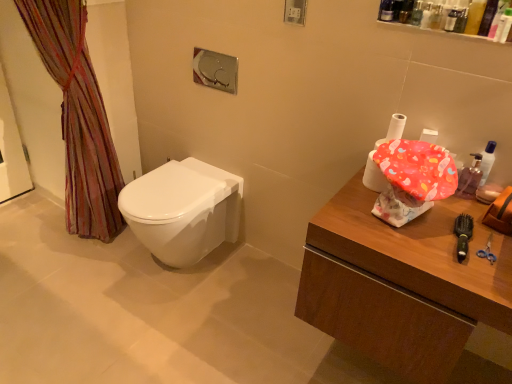
Locate an element on the screen. The width and height of the screenshot is (512, 384). free point in front of translucent plastic mouthwash at upper right, which appears as the first mouthwash when ordered from the bottom is located at coordinates (469, 221).